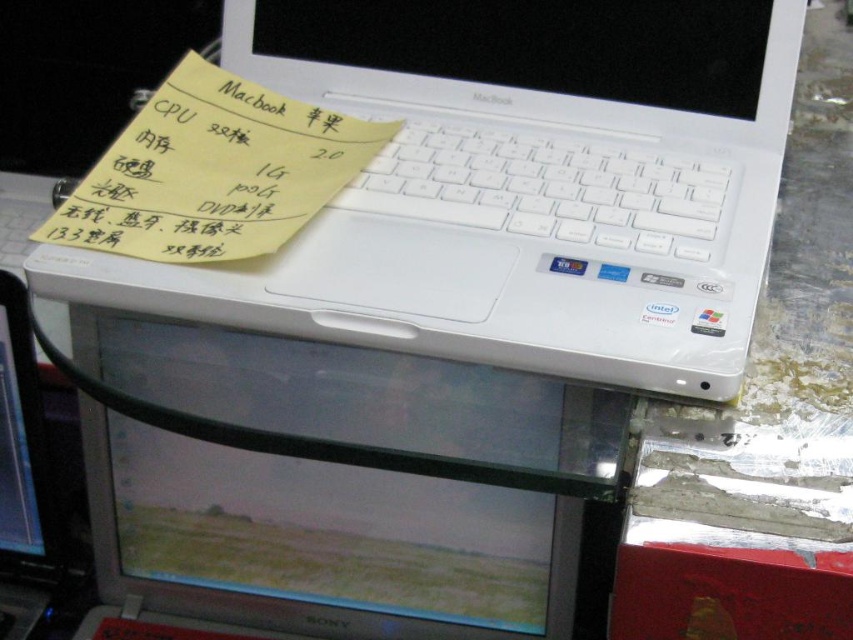
Question: Does white plastic laptop at upper center appear on the right side of yellow paper at upper left?

Choices:
 (A) yes
 (B) no

Answer: (A)

Question: Is white plastic laptop at upper center wider than matte plastic monitor at center?

Choices:
 (A) no
 (B) yes

Answer: (B)

Question: Among these points, which one is nearest to the camera?

Choices:
 (A) (646, 77)
 (B) (532, 422)
 (C) (22, 592)

Answer: (B)

Question: Which point is farther from the camera taking this photo?

Choices:
 (A) (231, 93)
 (B) (55, 561)

Answer: (B)

Question: Is white plastic laptop at upper center wider than yellow paper at upper left?

Choices:
 (A) yes
 (B) no

Answer: (A)

Question: Which point is farther to the camera?

Choices:
 (A) white plastic laptop at lower left
 (B) matte plastic monitor at center
 (C) white plastic laptop at upper center
 (D) yellow paper at upper left

Answer: (A)